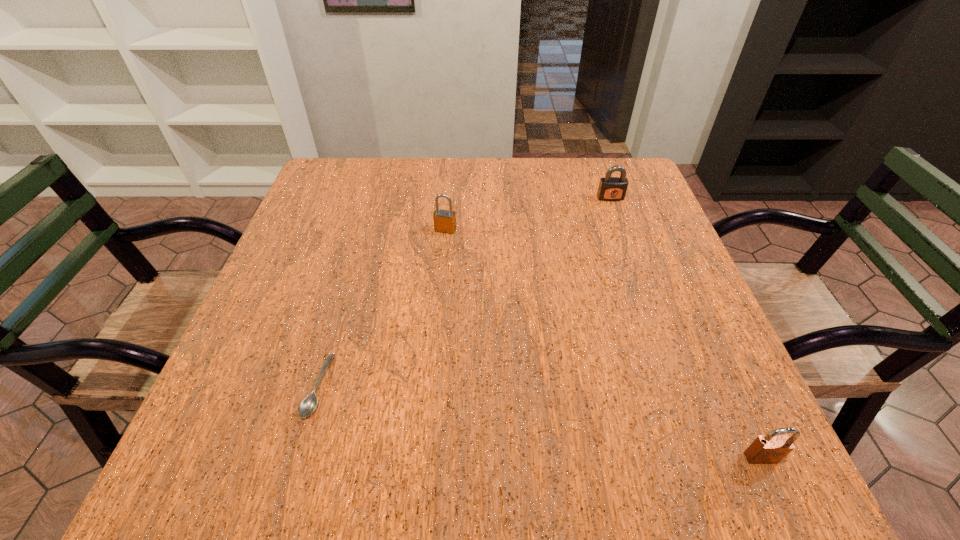
This screenshot has width=960, height=540. I want to click on blank space at the far left corner, so click(340, 192).

In the image, there is a desktop. Identify the location of blank space at the far right corner. (589, 176).

This screenshot has height=540, width=960. In the image, there is a desktop. What are the coordinates of `vacant space at the near right corner` in the screenshot? It's located at (740, 453).

Image resolution: width=960 pixels, height=540 pixels. Find the location of `free space between the second padlock from left to right and the nearest padlock`. free space between the second padlock from left to right and the nearest padlock is located at coordinates (685, 328).

I want to click on unoccupied position between the soupspoon and the farthest object, so click(464, 292).

Where is `unoccupied position between the leftmost padlock and the second object from right to left`? unoccupied position between the leftmost padlock and the second object from right to left is located at coordinates (528, 214).

Locate an element on the screen. This screenshot has height=540, width=960. empty space between the second farthest padlock and the farthest object is located at coordinates (528, 214).

Locate an element on the screen. free spot between the nearest padlock and the farthest padlock is located at coordinates tap(685, 328).

Find the location of a particular element. The width and height of the screenshot is (960, 540). free space between the second object from left to right and the second nearest object is located at coordinates (381, 308).

The image size is (960, 540). What are the coordinates of `vacant point located between the rightmost object and the third object from left to right` in the screenshot? It's located at (685, 328).